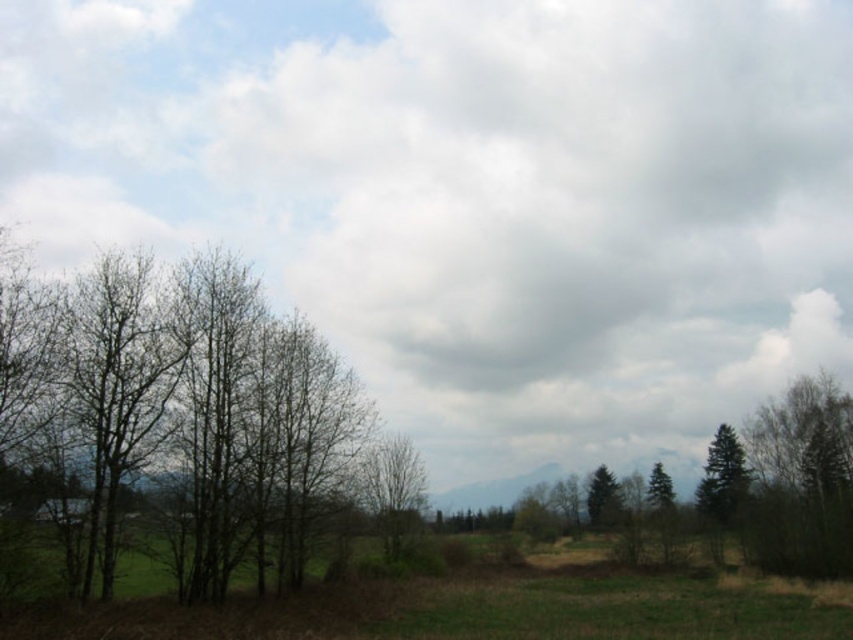
You are an environmental scientist analyzing this landscape. You observe the bare branches at left and the green matte tree at right. Which of these two trees is taller?

The bare branches at left is taller than the green matte tree at right.

You are standing in the scene and want to walk towards the smooth bark tree at center. Which direction should you walk to get closer to it without moving away from the green grassy field at lower center?

Answer: Since the green grassy field at lower center is closer to the viewer than the smooth bark tree at center, you should walk forward towards the smooth bark tree at center to move closer to it while staying near the green grassy field at lower center.